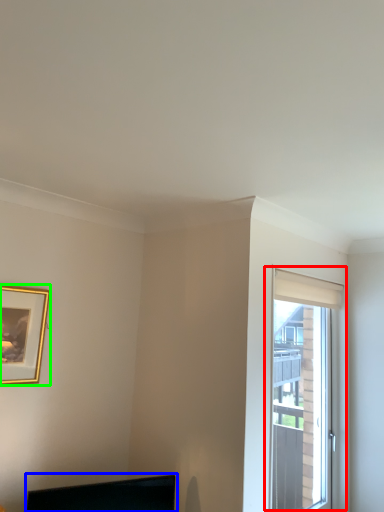
Question: Which is farther away from window (highlighted by a red box)? computer monitor (highlighted by a blue box) or picture frame (highlighted by a green box)?

Choices:
 (A) computer monitor
 (B) picture frame

Answer: (B)